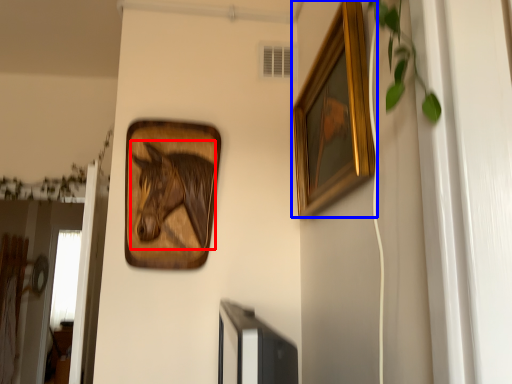
Question: Which object is further to the camera taking this photo, animal (highlighted by a red box) or picture frame (highlighted by a blue box)?

Choices:
 (A) animal
 (B) picture frame

Answer: (A)